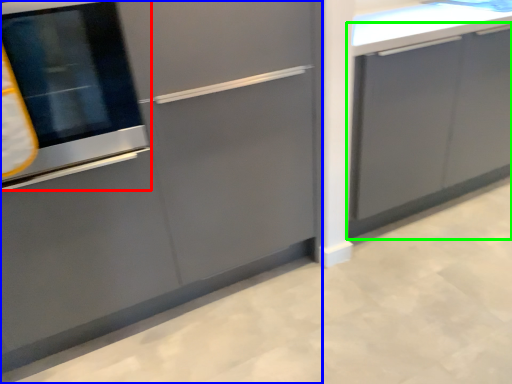
Question: Which object is the closest to the oven (highlighted by a red box)? Choose among these: cabinetry (highlighted by a blue box) or cabinetry (highlighted by a green box).

Choices:
 (A) cabinetry
 (B) cabinetry

Answer: (A)